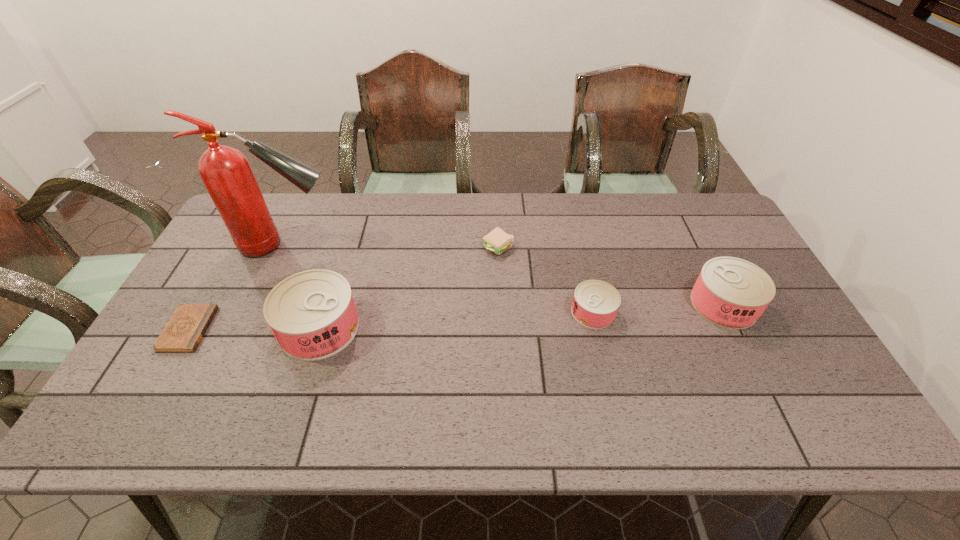
The image size is (960, 540). Identify the location of the leftmost can. (312, 314).

Where is `the third shortest object`? The image size is (960, 540). the third shortest object is located at coordinates (595, 303).

This screenshot has height=540, width=960. Find the location of `the fifth object from left to right`. the fifth object from left to right is located at coordinates (595, 303).

Identify the location of the fourth shortest object. (730, 292).

Locate an element on the screen. Image resolution: width=960 pixels, height=540 pixels. the rightmost object is located at coordinates (730, 292).

Where is `the third object from right to left`? This screenshot has width=960, height=540. the third object from right to left is located at coordinates (497, 241).

The image size is (960, 540). Identify the location of patty. (497, 241).

Locate an element on the screen. The width and height of the screenshot is (960, 540). the tallest object is located at coordinates (226, 173).

This screenshot has height=540, width=960. What are the coordinates of `the shortest object` in the screenshot? It's located at (184, 331).

This screenshot has width=960, height=540. I want to click on vacant space located on the left of the leftmost can, so click(x=243, y=328).